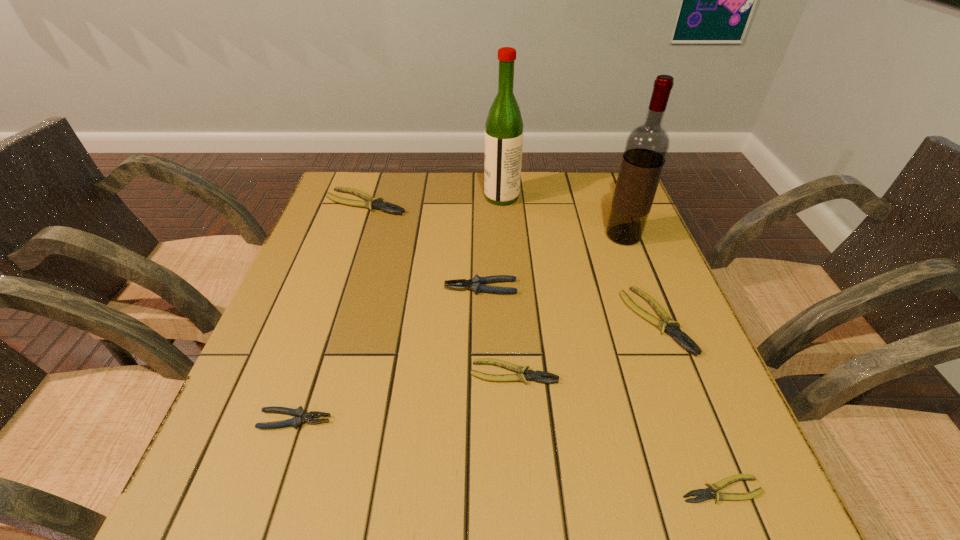
The image size is (960, 540). In order to click on vacant space that's between the right gray pliers and the liquor in this screenshot , I will do pyautogui.click(x=492, y=242).

Locate an element on the screen. This screenshot has height=540, width=960. vacant area that lies between the wine bottle and the farther gray pliers is located at coordinates (552, 262).

Where is `free space between the leftmost yellow pliers and the smallest yellow pliers`? The image size is (960, 540). free space between the leftmost yellow pliers and the smallest yellow pliers is located at coordinates (543, 346).

The width and height of the screenshot is (960, 540). Identify the location of free space between the bigger gray pliers and the sixth nearest object. (552, 262).

At what (x,y) coordinates should I click in order to perform the action: click on vacant space in between the shortest pliers and the second nearest pliers. Please return your answer as a coordinate pair (x, y). Looking at the image, I should click on (508, 455).

The image size is (960, 540). What are the coordinates of `vacant region between the second farthest yellow pliers and the sixth nearest object` in the screenshot? It's located at (639, 278).

Identify the location of vacant space that's between the left gray pliers and the bigger gray pliers. (388, 354).

Identify the location of vacant area that lies between the farthest yellow pliers and the right gray pliers. (423, 245).

Locate which object is the fourth closest to the bigger gray pliers. Please provide its 2D coordinates. Your answer should be formatted as a tuple, i.e. [(x, y)], where the tuple contains the x and y coordinates of a point satisfying the conditions above.

[(371, 202)]

Choose which object is the nearest neighbor to the second farthest yellow pliers. Please provide its 2D coordinates. Your answer should be formatted as a tuple, i.e. [(x, y)], where the tuple contains the x and y coordinates of a point satisfying the conditions above.

[(646, 148)]